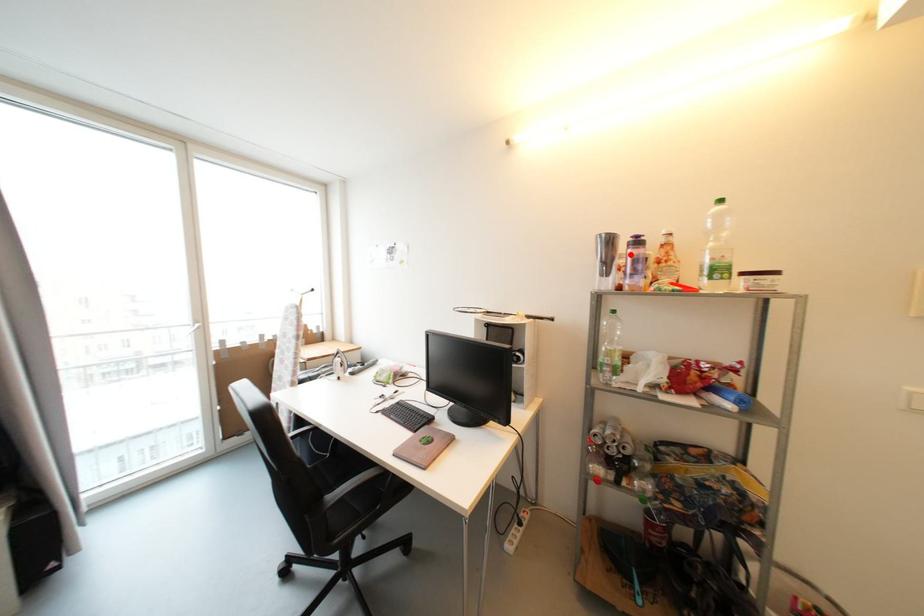
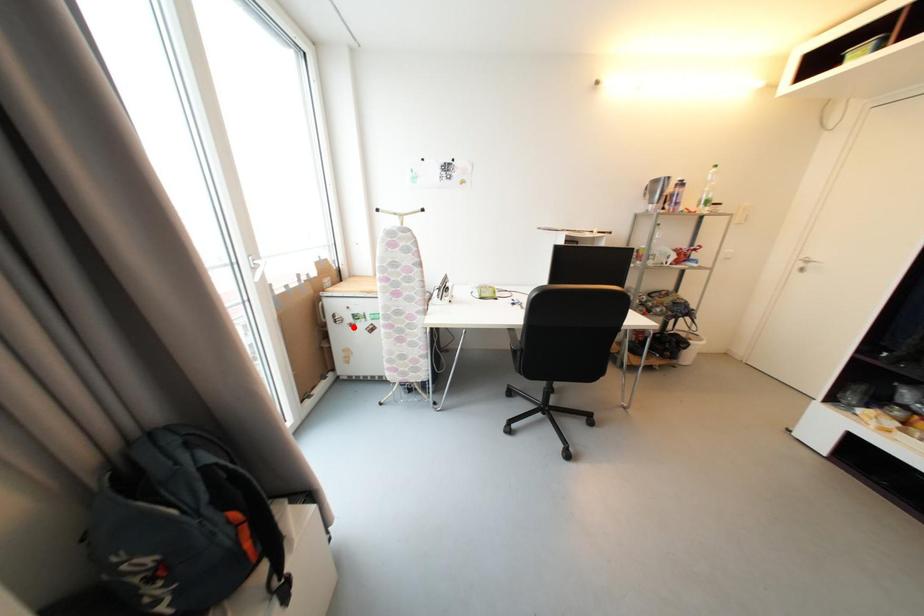
I am providing you with two images of the same scene from different viewpoints. A red point is marked on the first image and another point is marked on the second image. Do the highlighted points in image1 and image2 indicate the same real-world spot?

No